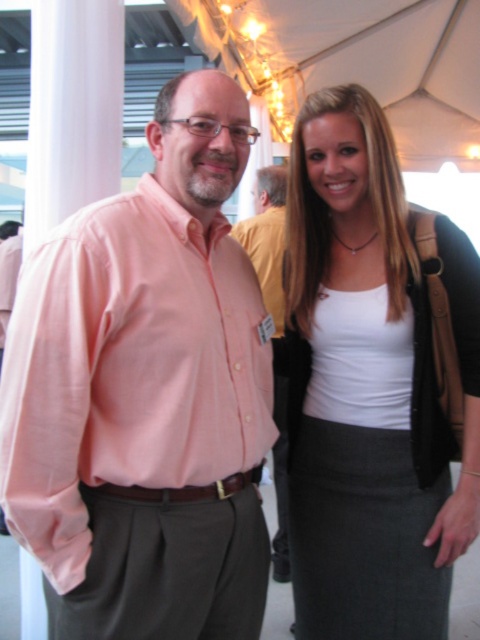
Question: Which is farther from the white matte tank top at center?

Choices:
 (A) pink linen shirt at center
 (B) pink cotton shirt at center

Answer: (A)

Question: Estimate the real-world distances between objects in this image. Which object is farther from the pink cotton shirt at center?

Choices:
 (A) pink linen shirt at center
 (B) white matte tank top at center

Answer: (A)

Question: Can you confirm if white matte tank top at center is positioned to the right of pink linen shirt at center?

Choices:
 (A) no
 (B) yes

Answer: (B)

Question: Based on their relative distances, which object is farther from the pink linen shirt at center?

Choices:
 (A) white matte tank top at center
 (B) pink cotton shirt at center

Answer: (B)

Question: Can you confirm if pink cotton shirt at center is positioned to the right of pink linen shirt at center?

Choices:
 (A) no
 (B) yes

Answer: (A)

Question: Is pink cotton shirt at center smaller than pink linen shirt at center?

Choices:
 (A) yes
 (B) no

Answer: (A)